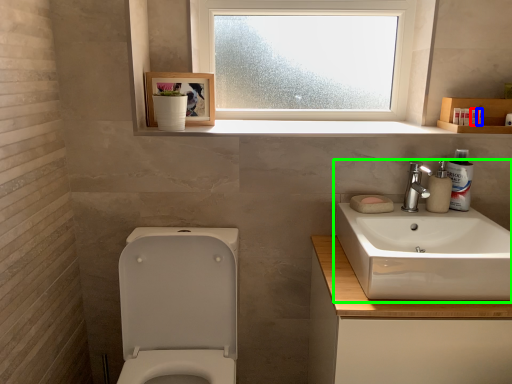
Question: Which object is the closest to the toiletry (highlighted by a red box)? Choose among these: toiletry (highlighted by a blue box) or sink (highlighted by a green box).

Choices:
 (A) toiletry
 (B) sink

Answer: (A)